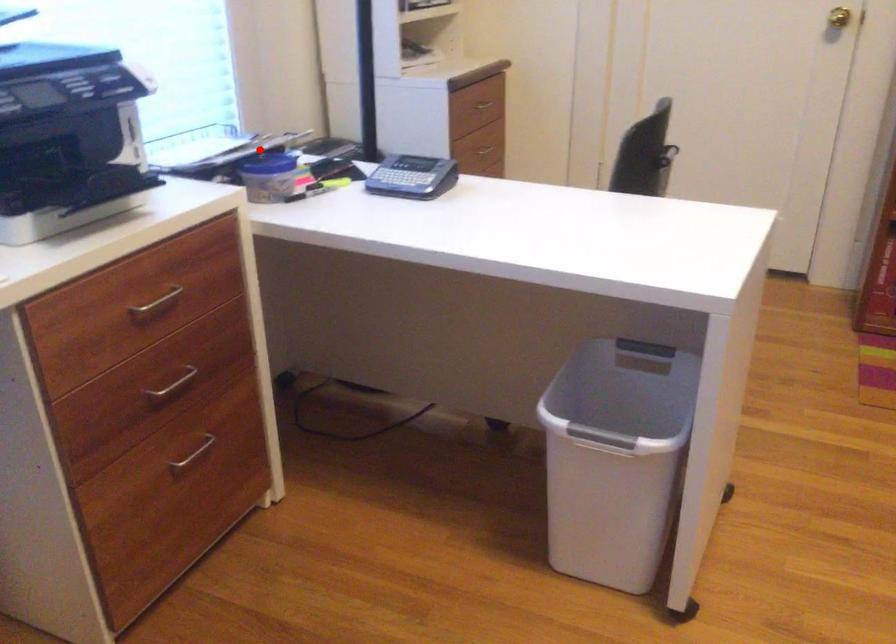
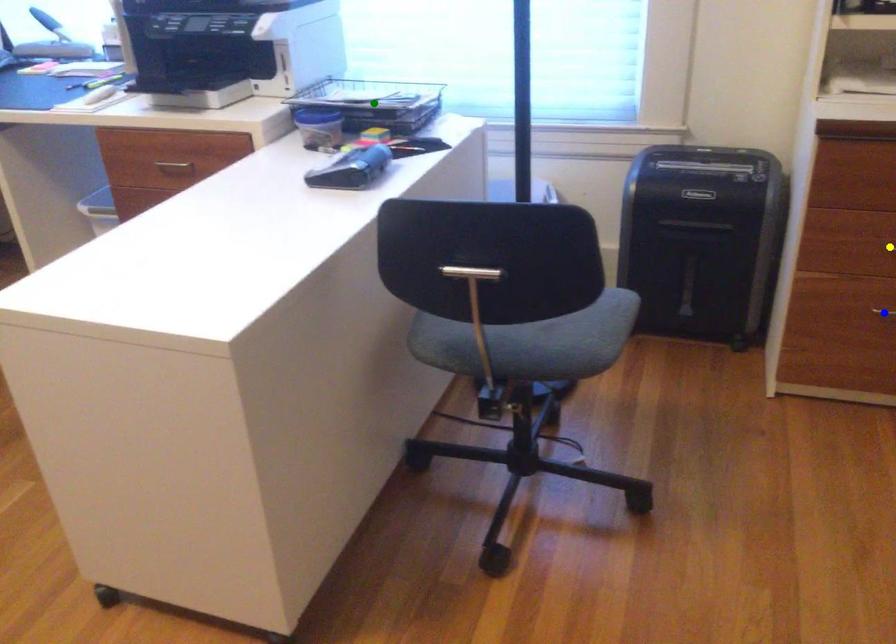
Question: I am providing you with two images of the same scene from different viewpoints. A red point is marked on the first image. You are given multiple points on the second image. Which mark in image 2 goes with the point in image 1?

Choices:
 (A) yellow point
 (B) blue point
 (C) green point

Answer: (C)